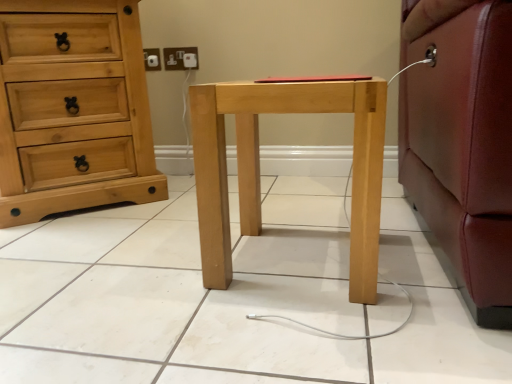
This screenshot has width=512, height=384. I want to click on unoccupied region to the right of natural wood nightstand at center, so click(413, 258).